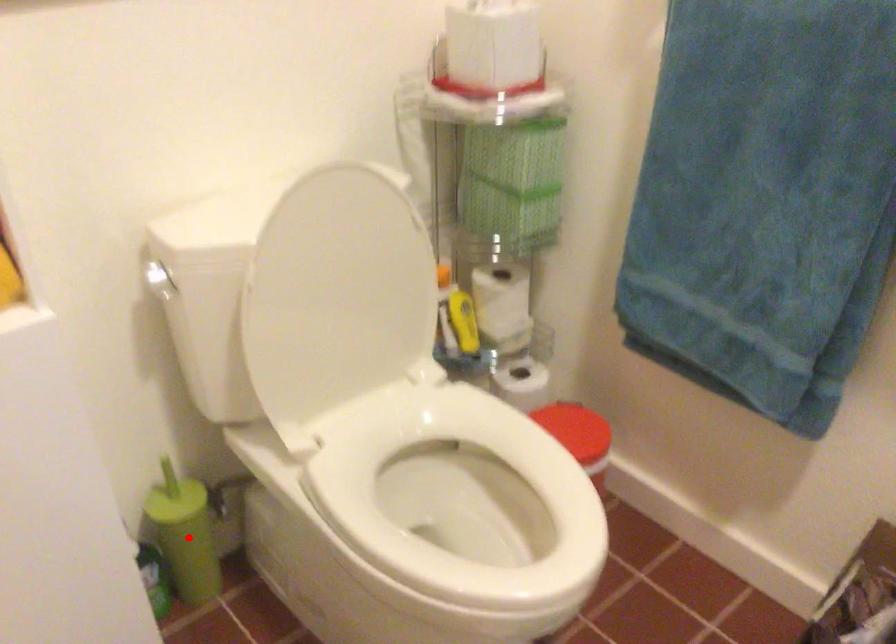
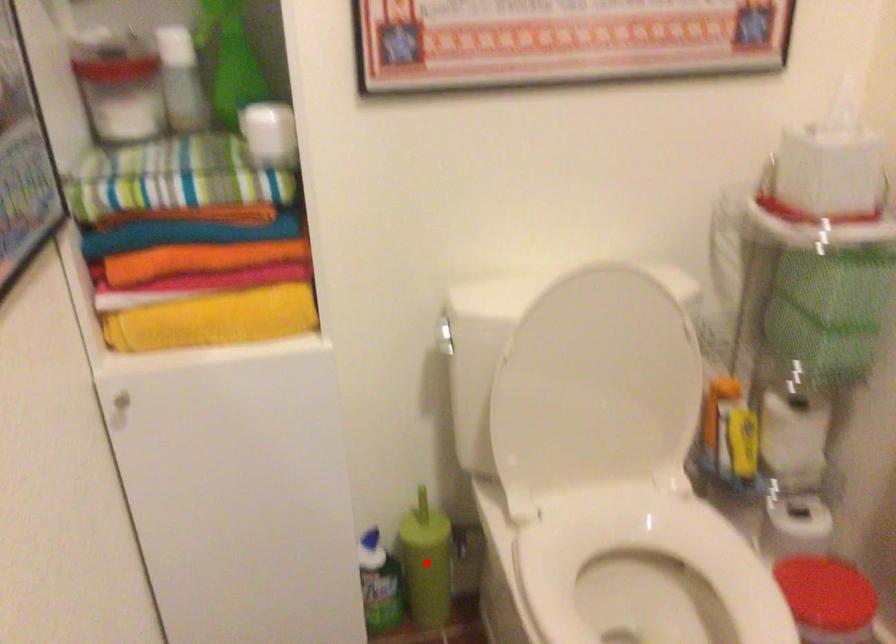
I am providing you with two images of the same scene from different viewpoints. A red point is marked on the first image and another point is marked on the second image. Does the point marked in image1 correspond to the same location as the one in image2?

Yes